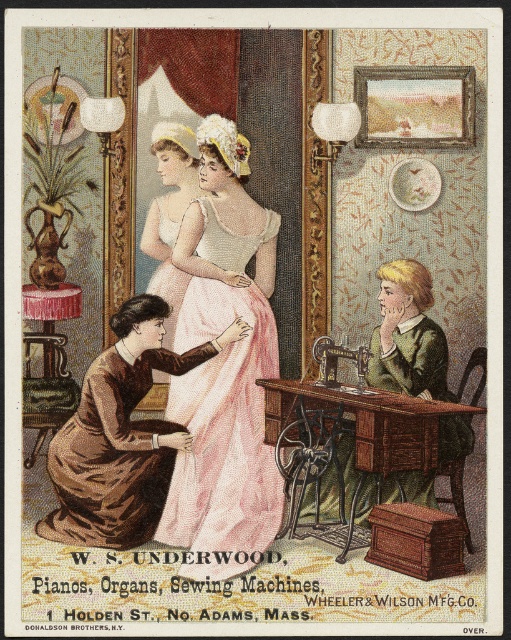
Question: Can you confirm if pink satin dress at center is wider than metallic silver sewing machine at center?

Choices:
 (A) no
 (B) yes

Answer: (B)

Question: Is pink satin dress at center behind matte white dress at center?

Choices:
 (A) no
 (B) yes

Answer: (A)

Question: Does pink satin dress at center appear on the left side of metallic silver sewing machine at center?

Choices:
 (A) yes
 (B) no

Answer: (A)

Question: Which of the following is the closest to the observer?

Choices:
 (A) (267, 308)
 (B) (187, 134)
 (C) (361, 349)
 (D) (91, 525)

Answer: (C)

Question: Among these points, which one is farthest from the camera?

Choices:
 (A) (152, 284)
 (B) (360, 374)
 (C) (252, 244)

Answer: (A)

Question: Which of the following is the farthest from the observer?

Choices:
 (A) (169, 467)
 (B) (321, 376)
 (C) (173, 173)

Answer: (C)